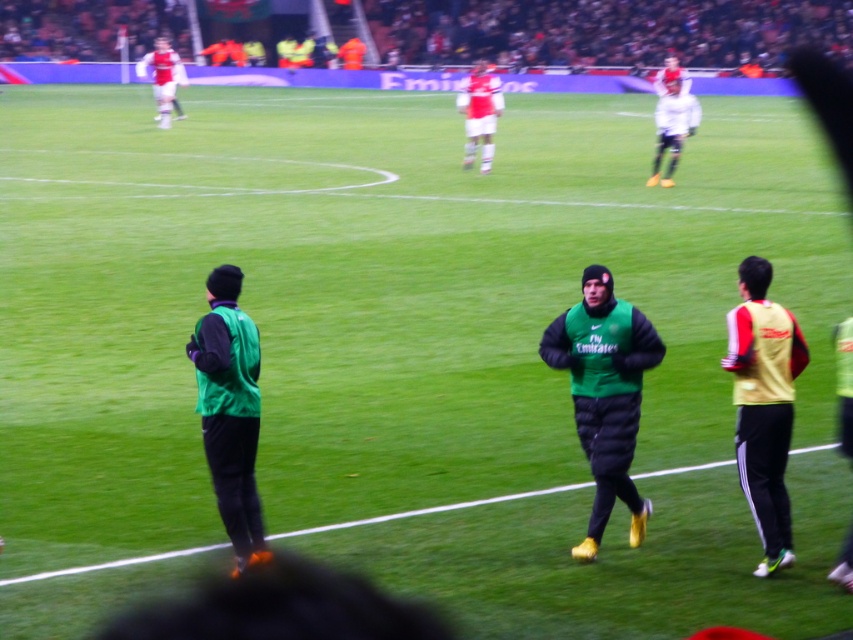
Question: Is green matte vest at center in front of white matte soccer player at upper left?

Choices:
 (A) no
 (B) yes

Answer: (B)

Question: Which point is farther from the camera taking this photo?

Choices:
 (A) (241, 468)
 (B) (483, 74)
 (C) (157, 58)

Answer: (C)

Question: Which object is closer to the camera taking this photo?

Choices:
 (A) green matte vest at center
 (B) matte red shorts at center

Answer: (A)

Question: Which point appears closest to the camera in this image?

Choices:
 (A) (480, 108)
 (B) (737, 451)
 (C) (165, 108)

Answer: (B)

Question: In this image, where is matte red shorts at center located relative to white matte soccer player at upper left?

Choices:
 (A) below
 (B) above

Answer: (A)

Question: Can you confirm if green matte jacket at center is positioned below yellow/green jersey at right?

Choices:
 (A) yes
 (B) no

Answer: (B)